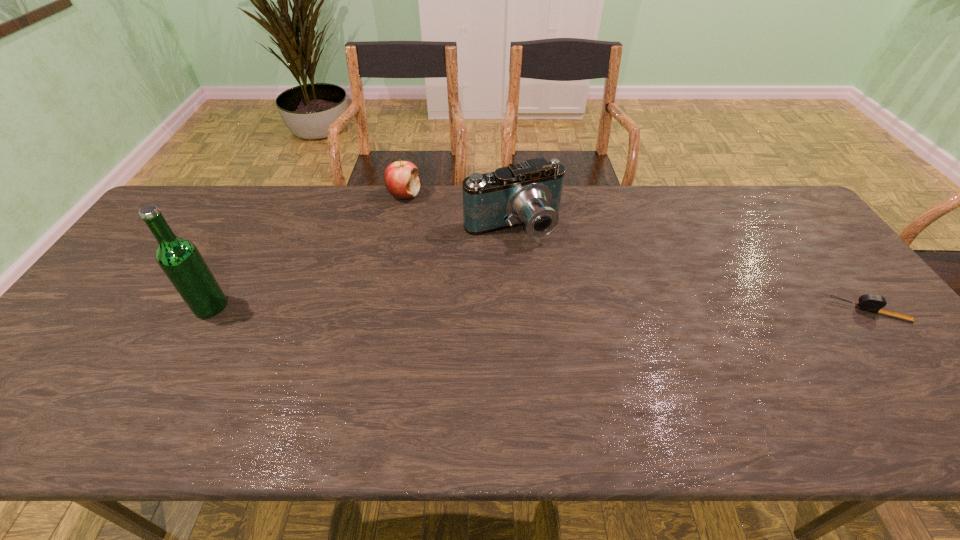
In order to click on vacant spot on the desktop that is between the tallest object and the rightmost object and is positioned on the front-facing side of the third object from left to right in this screenshot , I will do `click(564, 309)`.

The image size is (960, 540). I want to click on free space on the desktop that is between the beer bottle and the rightmost object and is positioned on the bitten side of the third tallest object, so click(482, 308).